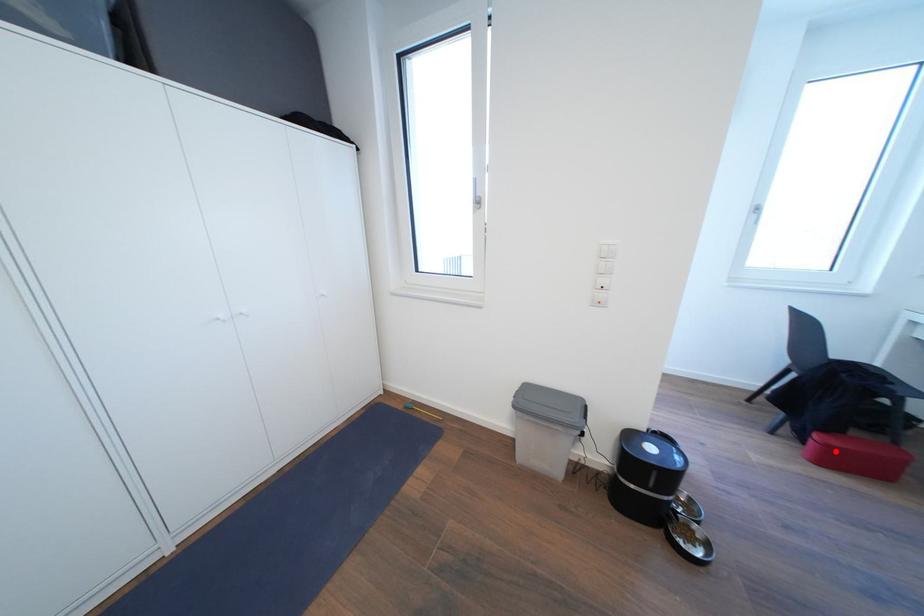
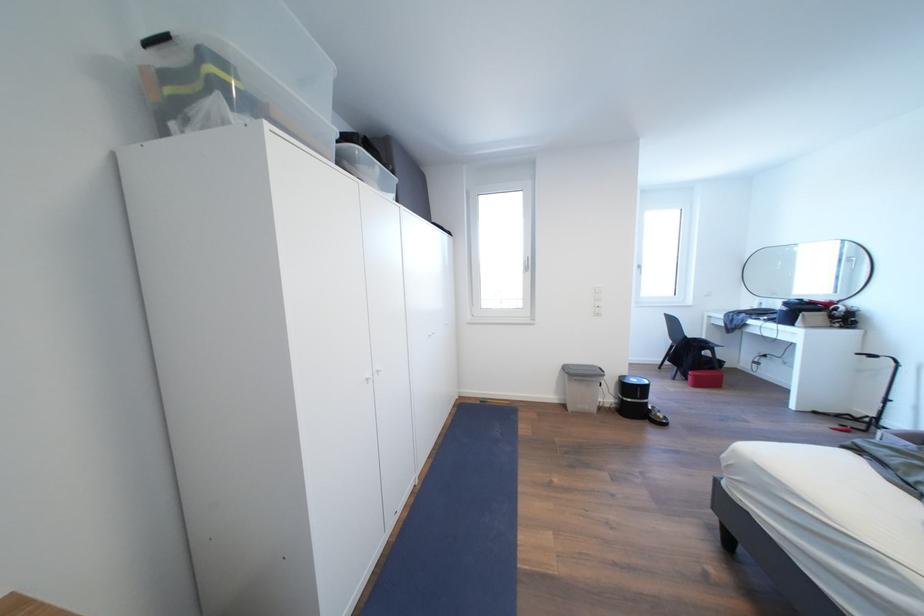
Find the pixel in the second image that matches the highlighted location in the first image.

(703, 381)